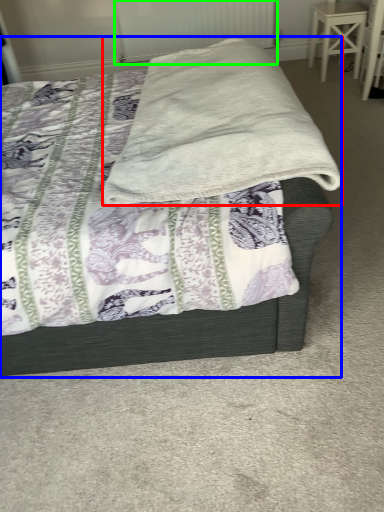
Question: Which is nearer to the blanket (highlighted by a red box)? bed (highlighted by a blue box) or radiator (highlighted by a green box).

Choices:
 (A) bed
 (B) radiator

Answer: (A)